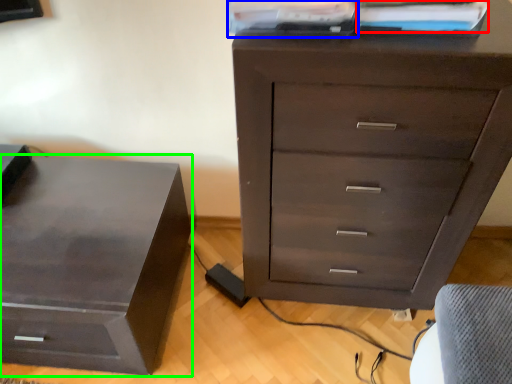
Question: Which object is the closest to the book (highlighted by a red box)? Choose among these: book (highlighted by a blue box) or nightstand (highlighted by a green box).

Choices:
 (A) book
 (B) nightstand

Answer: (A)